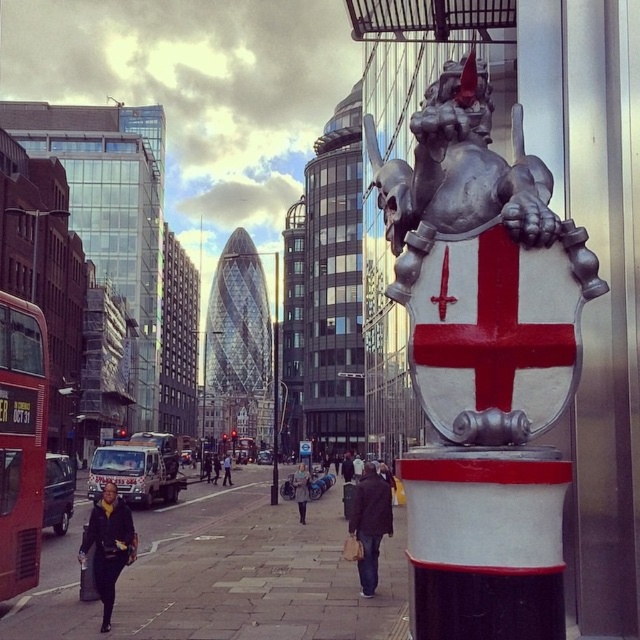
Does silver metallic shield at upper right have a lesser height compared to red double-decker bus at left?

No, silver metallic shield at upper right is not shorter than red double-decker bus at left.

Between point (492, 275) and point (35, 547), which one is positioned behind?

The point (35, 547) is more distant.

The height and width of the screenshot is (640, 640). What do you see at coordinates (480, 260) in the screenshot? I see `silver metallic shield at upper right` at bounding box center [480, 260].

You are a GUI agent. You are given a task and a screenshot of the screen. Output one action in this format:
    pyautogui.click(x=<x>, y=<y>)
    Task: Click on the silver metallic shield at upper right
    The image size is (640, 640).
    Given the screenshot: What is the action you would take?
    pyautogui.click(x=480, y=260)

Is paved stone sidewalk at lower left shorter than red double-decker bus at left?

In fact, paved stone sidewalk at lower left may be taller than red double-decker bus at left.

Can you confirm if paved stone sidewalk at lower left is positioned to the right of red double-decker bus at left?

Yes, paved stone sidewalk at lower left is to the right of red double-decker bus at left.

Is point (211, 600) farther from camera compared to point (17, 454)?

Yes, point (211, 600) is behind point (17, 454).

Image resolution: width=640 pixels, height=640 pixels. What are the coordinates of `paved stone sidewalk at lower left` in the screenshot? It's located at (253, 572).

Does silver metallic shield at upper right appear on the right side of paved stone sidewalk at lower left?

Correct, you'll find silver metallic shield at upper right to the right of paved stone sidewalk at lower left.

Based on the photo, does silver metallic shield at upper right have a smaller size compared to paved stone sidewalk at lower left?

Yes, silver metallic shield at upper right is smaller than paved stone sidewalk at lower left.

Who is more forward, (488, 420) or (282, 612)?

Point (488, 420) is more forward.

Image resolution: width=640 pixels, height=640 pixels. What are the coordinates of `silver metallic shield at upper right` in the screenshot? It's located at (480, 260).